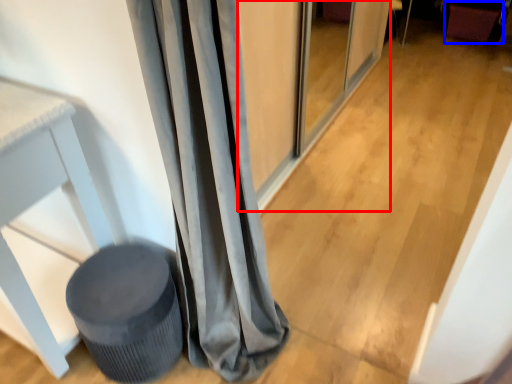
Question: Which object appears farthest to the camera in this image, screen door (highlighted by a red box) or swivel chair (highlighted by a blue box)?

Choices:
 (A) screen door
 (B) swivel chair

Answer: (B)